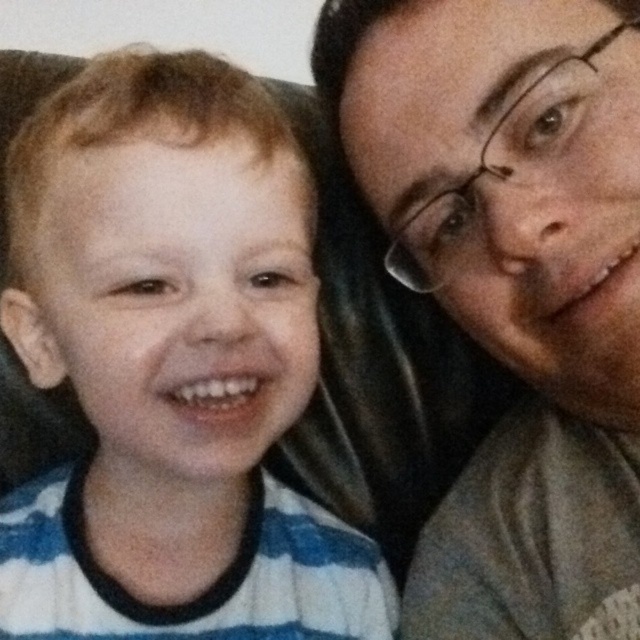
Is white striped sweater at left below matte gray shirt at right?

→ Indeed, white striped sweater at left is positioned under matte gray shirt at right.

Between white striped sweater at left and matte gray shirt at right, which one has less height?

Standing shorter between the two is white striped sweater at left.

What do you see at coordinates (172, 365) in the screenshot? This screenshot has width=640, height=640. I see `white striped sweater at left` at bounding box center [172, 365].

The height and width of the screenshot is (640, 640). In order to click on white striped sweater at left in this screenshot , I will do `click(172, 365)`.